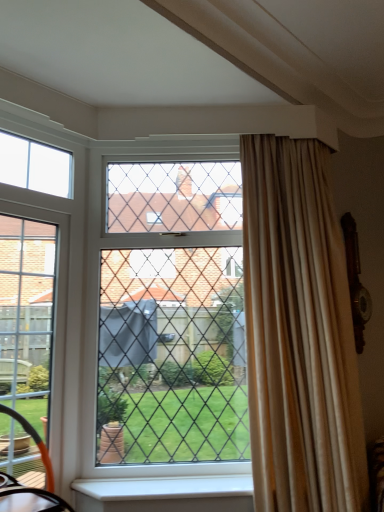
Image resolution: width=384 pixels, height=512 pixels. I want to click on clear glass window at upper left, so click(35, 166).

Where is `white smooth window sill at lower center`? This screenshot has height=512, width=384. white smooth window sill at lower center is located at coordinates (165, 493).

The width and height of the screenshot is (384, 512). Identify the location of clear glass window at center. (172, 316).

Find the location of a particular element. This screenshot has height=512, width=384. clear glass screen door at left is located at coordinates (27, 317).

From the image's perspective, is white smooth window sill at lower center above or below clear glass window at upper left?

white smooth window sill at lower center is situated lower than clear glass window at upper left in the image.

From a real-world perspective, who is located higher, white smooth window sill at lower center or clear glass window at upper left?

clear glass window at upper left.

Which object is positioned more to the right, white smooth window sill at lower center or clear glass window at upper left?

From the viewer's perspective, white smooth window sill at lower center appears more on the right side.

Where is `window above the white smooth window sill at lower center (from the image's perspective)`? The height and width of the screenshot is (512, 384). window above the white smooth window sill at lower center (from the image's perspective) is located at coordinates (35, 166).

Considering the positions of objects beige silk curtain at right and clear glass window at upper left in the image provided, who is more to the right, beige silk curtain at right or clear glass window at upper left?

Positioned to the right is beige silk curtain at right.

Looking at this image, how many degrees apart are the facing directions of beige silk curtain at right and clear glass window at upper left?

There is a 46-degree angle between the facing directions of beige silk curtain at right and clear glass window at upper left.

From the image's perspective, which object appears higher, beige silk curtain at right or clear glass window at upper left?

clear glass window at upper left is shown above in the image.

Is point (353, 361) behind point (0, 144)?

No.

Is beige silk curtain at right oriented away from clear glass window at center?

beige silk curtain at right does not have its back to clear glass window at center.

Considering the sizes of objects beige silk curtain at right and clear glass window at center in the image provided, who is taller, beige silk curtain at right or clear glass window at center?

With more height is beige silk curtain at right.

Considering the positions of points (274, 214) and (203, 432), is point (274, 214) closer to camera compared to point (203, 432)?

Yes.

Locate an element on the screen. curtain below the clear glass window at center (from a real-world perspective) is located at coordinates (299, 333).

Is point (1, 357) farther from camera compared to point (67, 187)?

No, it is in front of (67, 187).

Do you think clear glass screen door at left is within clear glass window at upper left, or outside of it?

clear glass screen door at left cannot be found inside clear glass window at upper left.

From a real-world perspective, which is physically below, clear glass screen door at left or clear glass window at upper left?

clear glass screen door at left.

Considering the relative sizes of clear glass screen door at left and clear glass window at upper left in the image provided, is clear glass screen door at left shorter than clear glass window at upper left?

No, clear glass screen door at left is not shorter than clear glass window at upper left.

From the image's perspective, is clear glass screen door at left above or below clear glass window at center?

Based on their image positions, clear glass screen door at left is located beneath clear glass window at center.

Does point (15, 274) appear closer or farther from the camera than point (232, 457)?

Point (15, 274) is closer to the camera than point (232, 457).

Considering the sizes of clear glass screen door at left and clear glass window at center in the image, is clear glass screen door at left taller or shorter than clear glass window at center?

In the image, clear glass screen door at left appears to be shorter than clear glass window at center.

Could you tell me if clear glass screen door at left is facing clear glass window at center?

No, clear glass screen door at left is not facing towards clear glass window at center.

Looking at this image, which object is positioned more to the right, clear glass window at center or clear glass window at upper left?

From the viewer's perspective, clear glass window at center appears more on the right side.

Which is closer, (139, 366) or (43, 175)?

Point (139, 366).

Between clear glass window at center and clear glass window at upper left, which one has smaller width?

With smaller width is clear glass window at upper left.

From their relative heights in the image, would you say clear glass window at center is taller or shorter than clear glass window at upper left?

clear glass window at center is taller than clear glass window at upper left.

Considering the sizes of clear glass window at upper left and white smooth window sill at lower center in the image, is clear glass window at upper left wider or thinner than white smooth window sill at lower center?

Result: In the image, clear glass window at upper left appears to be more narrow than white smooth window sill at lower center.

Which of these two, clear glass window at upper left or white smooth window sill at lower center, is smaller?

Smaller between the two is clear glass window at upper left.

Can you see clear glass window at upper left touching white smooth window sill at lower center?

No, clear glass window at upper left is not touching white smooth window sill at lower center.

At what (x,y) coordinates should I click in order to perform the action: click on window located above the white smooth window sill at lower center (from the image's perspective). Please return your answer as a coordinate pair (x, y). The width and height of the screenshot is (384, 512). Looking at the image, I should click on (35, 166).

Locate an element on the screen. window on the left of beige silk curtain at right is located at coordinates (35, 166).

Looking at the image, which one is located closer to clear glass window at center, clear glass screen door at left or white smooth window sill at lower center?

The object closer to clear glass window at center is clear glass screen door at left.

Estimate the real-world distances between objects in this image. Which object is closer to clear glass window at upper left, clear glass screen door at left or white smooth window sill at lower center?

clear glass screen door at left lies closer to clear glass window at upper left than the other object.

When comparing their distances from clear glass window at center, does clear glass window at upper left or clear glass screen door at left seem closer?

clear glass screen door at left is closer to clear glass window at center.

Looking at the image, which one is located closer to white smooth window sill at lower center, clear glass screen door at left or clear glass window at upper left?

Based on the image, clear glass screen door at left appears to be nearer to white smooth window sill at lower center.

Looking at the image, which one is located closer to clear glass window at upper left, white smooth window sill at lower center or clear glass window at center?

The object closer to clear glass window at upper left is clear glass window at center.

Consider the image. Estimate the real-world distances between objects in this image. Which object is closer to beige silk curtain at right, clear glass window at upper left or white smooth window sill at lower center?

white smooth window sill at lower center is positioned closer to the anchor beige silk curtain at right.

When comparing their distances from beige silk curtain at right, does clear glass window at center or clear glass screen door at left seem closer?

Among the two, clear glass window at center is located nearer to beige silk curtain at right.

Which object lies further to the anchor point clear glass screen door at left, clear glass window at center or white smooth window sill at lower center?

The object further to clear glass screen door at left is white smooth window sill at lower center.

The image size is (384, 512). Identify the location of curtain between clear glass window at center and white smooth window sill at lower center from top to bottom. 299,333.

Where is `curtain between clear glass window at upper left and white smooth window sill at lower center in the up-down direction`? The width and height of the screenshot is (384, 512). curtain between clear glass window at upper left and white smooth window sill at lower center in the up-down direction is located at coordinates (299, 333).

I want to click on glass window between clear glass window at upper left and white smooth window sill at lower center in the up-down direction, so click(x=172, y=316).

This screenshot has height=512, width=384. Identify the location of screen door between clear glass window at center and white smooth window sill at lower center vertically. 27,317.